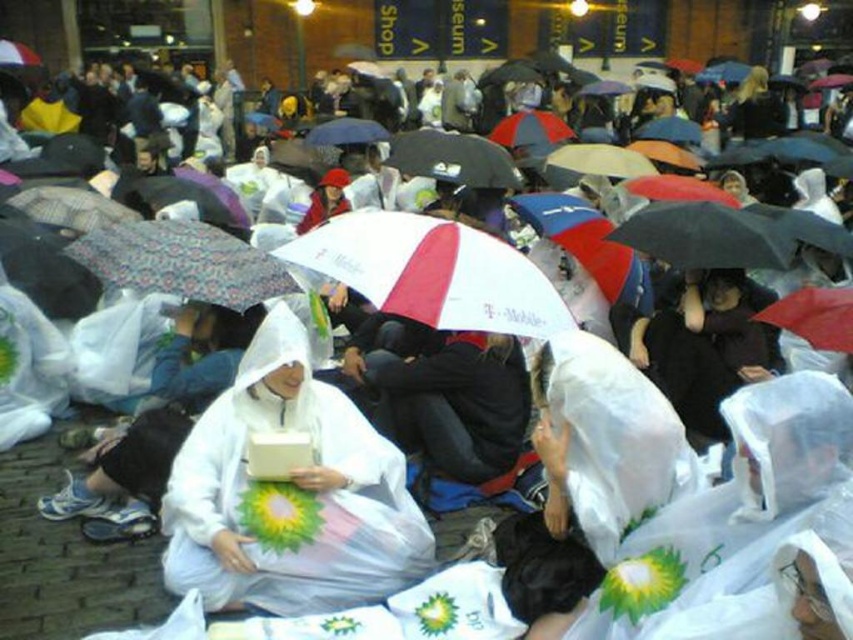
You are a photographer trying to capture a clear shot of the white matte raincoat at center and the patterned fabric umbrella at center. Which object is positioned lower in the image?

The white matte raincoat at center is below the patterned fabric umbrella at center, so the white matte raincoat at center is positioned lower in the image.

You are a photographer trying to capture a clear shot of the white matte raincoat at center and the whitematerialumbrella at center. Which object should you focus on first if you want to ensure both are in focus without adjusting your camera settings?

The white matte raincoat at center is taller than the whitematerialumbrella at center. Since the raincoat is taller, it is likely farther away from the camera than the umbrella. To keep both in focus, you should focus on the whitematerialumbrella at center first, as it is closer, and the depth of field will naturally include the taller, farther raincoat.